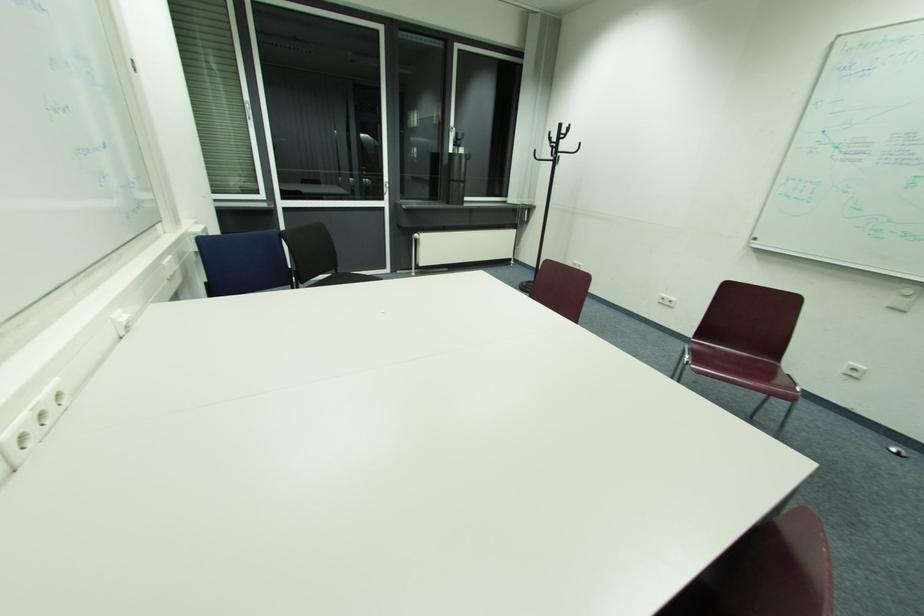
Identify the location of black chair sitting surface. Image resolution: width=924 pixels, height=616 pixels. (737, 369).